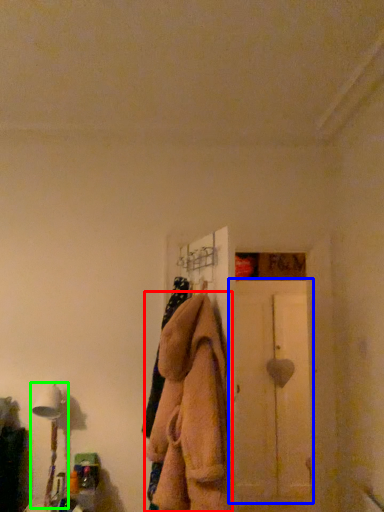
Question: Considering the real-world distances, which object is farthest from clothing (highlighted by a red box)? screen door (highlighted by a blue box) or table lamp (highlighted by a green box)?

Choices:
 (A) screen door
 (B) table lamp

Answer: (A)